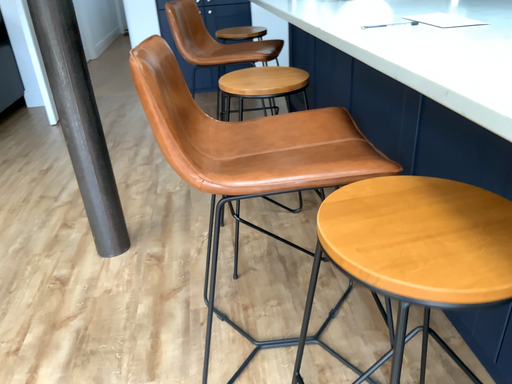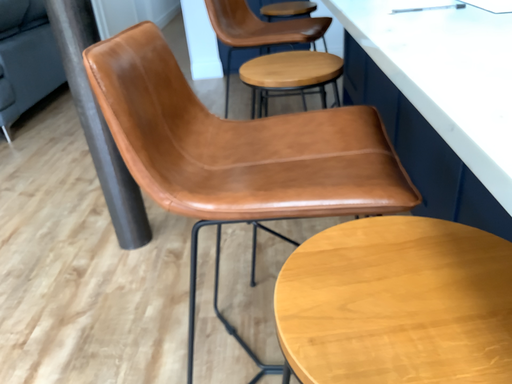
Question: How did the camera likely rotate when shooting the video?

Choices:
 (A) rotated right
 (B) rotated left

Answer: (B)